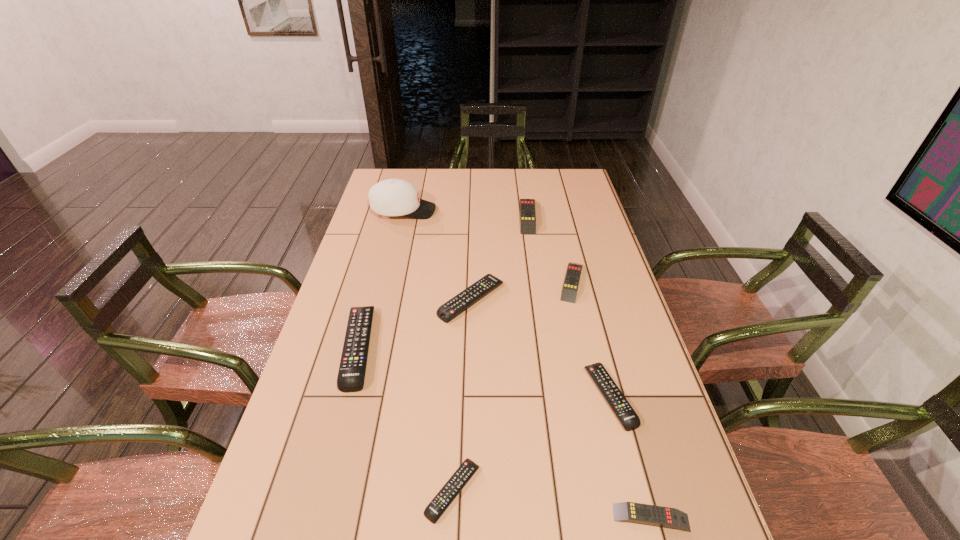
Locate an element on the screen. The height and width of the screenshot is (540, 960). baseball cap is located at coordinates (392, 197).

Where is `white baseball cap`? The image size is (960, 540). white baseball cap is located at coordinates (392, 197).

The image size is (960, 540). I want to click on the leftmost yellow remote control, so click(527, 206).

Find the location of a particular element. The height and width of the screenshot is (540, 960). the farthest remote control is located at coordinates (527, 206).

Image resolution: width=960 pixels, height=540 pixels. I want to click on the leftmost black remote control, so click(351, 375).

What are the coordinates of `the leftmost remote control` in the screenshot? It's located at (351, 375).

In order to click on the second nearest yellow remote control in this screenshot , I will do `click(569, 292)`.

I want to click on the second biggest black remote control, so click(x=449, y=310).

Identify the location of the rightmost black remote control. (621, 407).

Locate an element on the screen. the nearest yellow remote control is located at coordinates (661, 516).